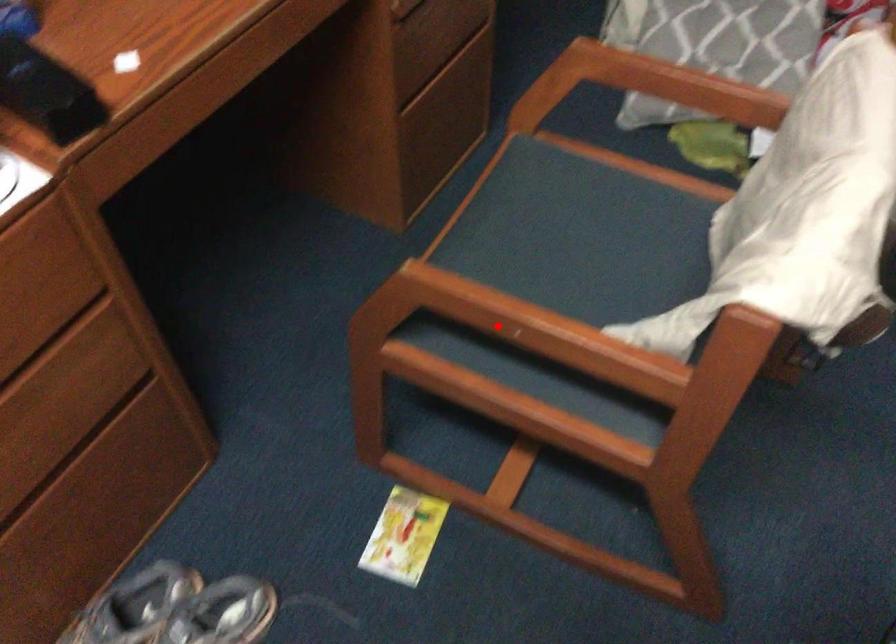
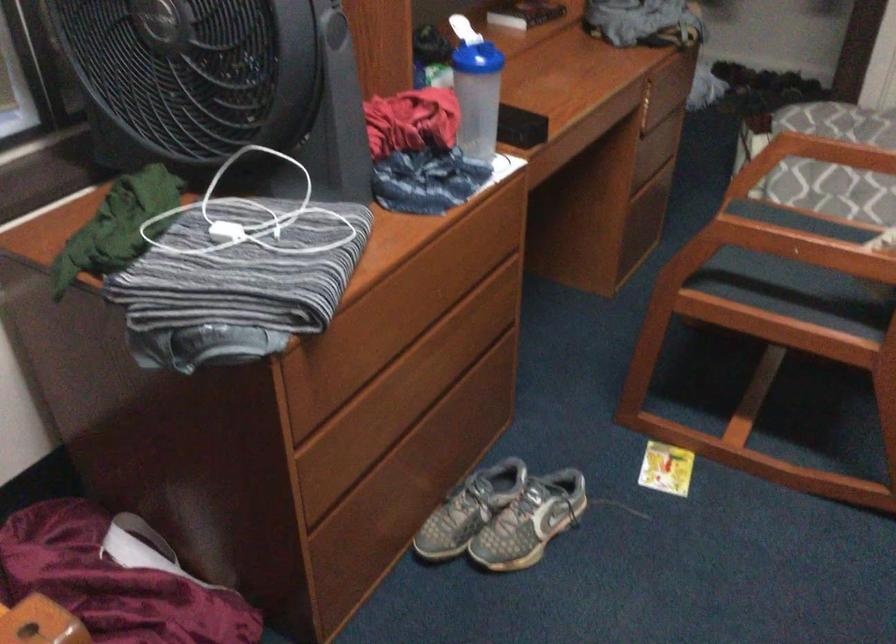
Question: I am providing you with two images of the same scene from different viewpoints. In image1, a red point is highlighted. Considering the same 3D point in image2, which of the following is correct?

Choices:
 (A) It is closer
 (B) It is farther

Answer: (B)